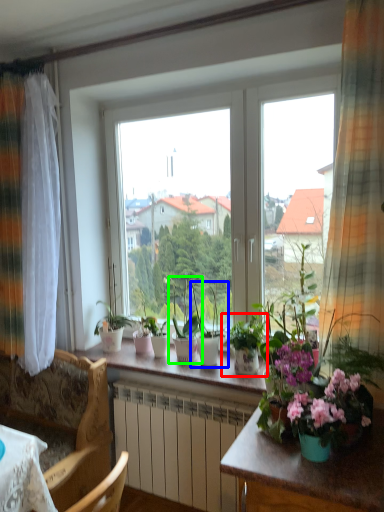
Question: Which is farther away from houseplant (highlighted by a red box)? houseplant (highlighted by a blue box) or houseplant (highlighted by a green box)?

Choices:
 (A) houseplant
 (B) houseplant

Answer: (B)